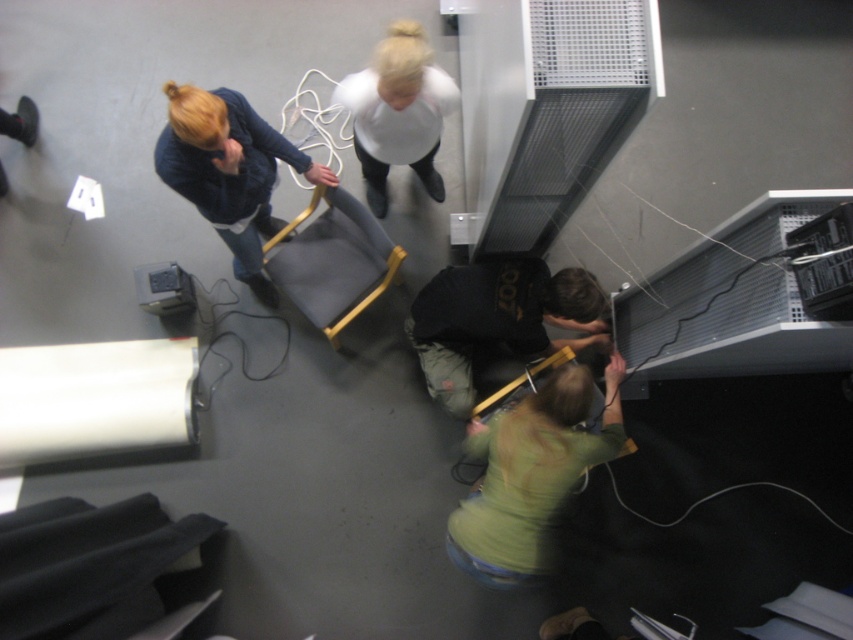
Question: Is green matte shirt at lower center closer to the viewer compared to blonde hair at upper left?

Choices:
 (A) no
 (B) yes

Answer: (A)

Question: Which point is farther to the camera?

Choices:
 (A) dark green fabric at lower center
 (B) blonde hair at upper left
 (C) green matte shirt at lower center
 (D) metallic gray projector at lower left

Answer: (D)

Question: Considering the real-world distances, which object is closest to the metallic gray projector at lower left?

Choices:
 (A) blonde hair at upper left
 (B) green matte shirt at lower center
 (C) white matte shirt at center

Answer: (A)

Question: Considering the real-world distances, which object is closest to the white matte shirt at center?

Choices:
 (A) dark green fabric at lower center
 (B) blonde hair at upper left
 (C) green matte shirt at lower center
 (D) metallic gray projector at lower left

Answer: (B)

Question: Can you confirm if blonde hair at upper left is positioned to the left of white matte shirt at center?

Choices:
 (A) no
 (B) yes

Answer: (B)

Question: Is green matte shirt at lower center positioned at the back of white matte shirt at center?

Choices:
 (A) no
 (B) yes

Answer: (B)